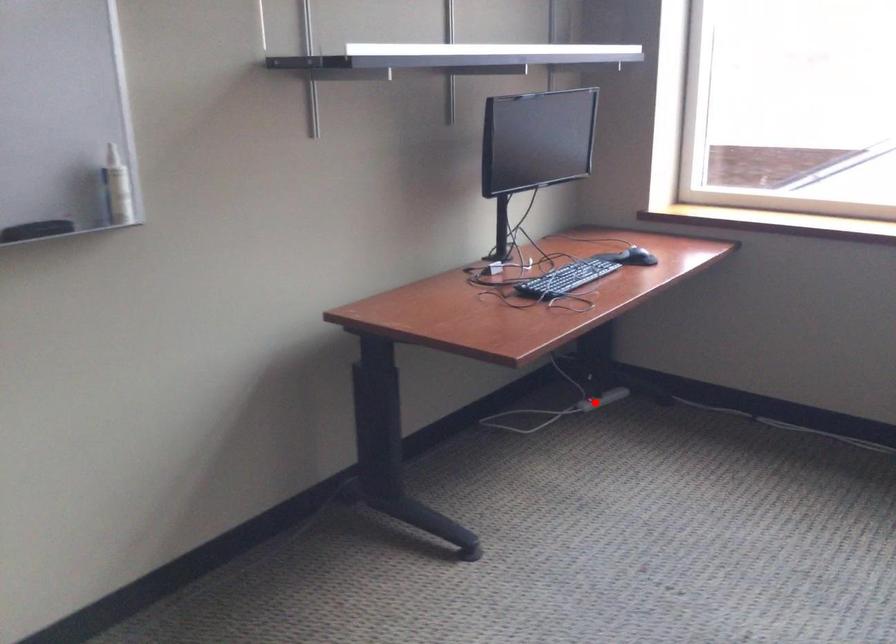
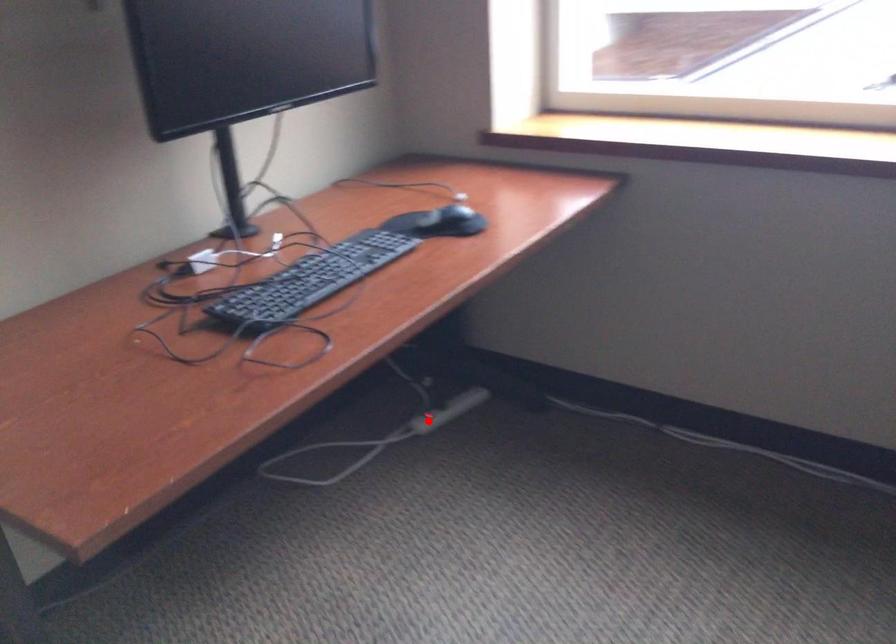
I am providing you with two images of the same scene from different viewpoints. A red point is marked on the first image and another point is marked on the second image. Are the points marked in image1 and image2 representing the same 3D position?

Yes